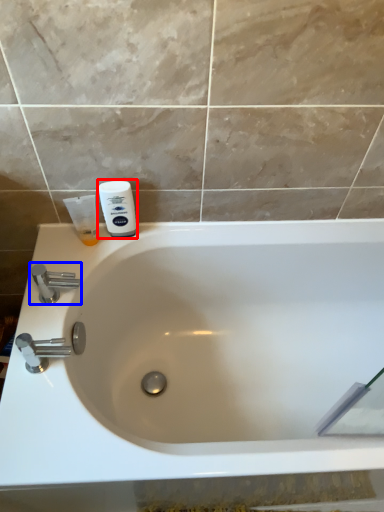
Question: Which of the following is the closest to the observer, shaving cream (highlighted by a red box) or tap (highlighted by a blue box)?

Choices:
 (A) shaving cream
 (B) tap

Answer: (B)